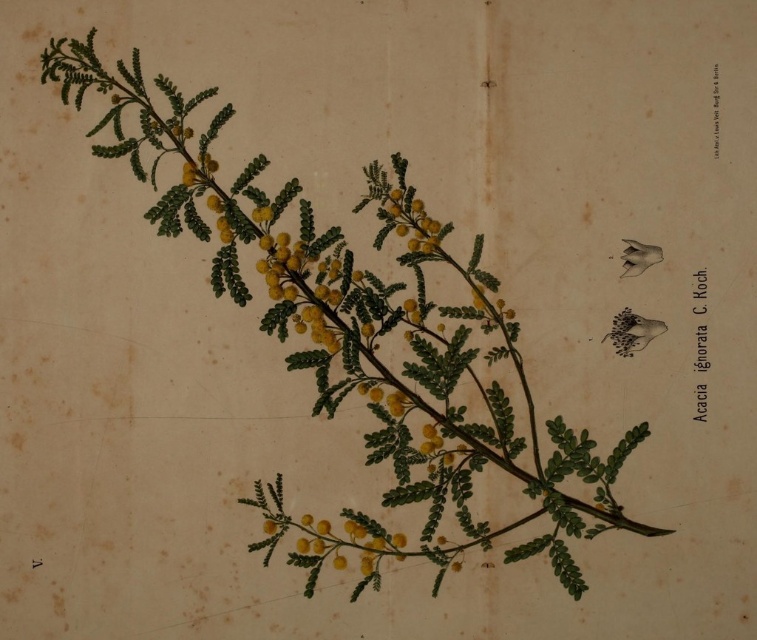
Question: Which object is closer to the camera taking this photo?

Choices:
 (A) yellow matte flower at upper right
 (B) smooth yellow flower at center

Answer: (A)

Question: Is smooth yellow flower at center below yellow matte flower at upper right?

Choices:
 (A) no
 (B) yes

Answer: (B)

Question: Is smooth yellow flower at center further to camera compared to yellow matte flower at upper right?

Choices:
 (A) yes
 (B) no

Answer: (A)

Question: Which point is closer to the camera?

Choices:
 (A) yellow matte flower at upper right
 (B) smooth yellow flower at center

Answer: (A)

Question: Can you confirm if smooth yellow flower at center is wider than yellow matte flower at upper right?

Choices:
 (A) no
 (B) yes

Answer: (B)